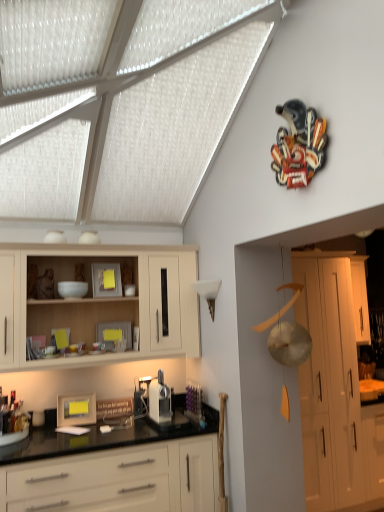
Question: From a real-world perspective, is light wood cabinet at upper left, acting as the 4th cabinetry starting from the right, over white glossy cabinet at right, which is the 1th cabinetry in right-to-left order?

Choices:
 (A) yes
 (B) no

Answer: (A)

Question: From a real-world perspective, does light wood cabinet at upper left, acting as the 4th cabinetry starting from the right, sit lower than white glossy cabinet at right, positioned as the 4th cabinetry in left-to-right order?

Choices:
 (A) yes
 (B) no

Answer: (B)

Question: Is white glossy cabinet at right, positioned as the 4th cabinetry in left-to-right order, at the back of light wood cabinet at upper left, which appears as the 1th cabinetry when viewed from the left?

Choices:
 (A) no
 (B) yes

Answer: (A)

Question: Considering the relative positions of light wood cabinet at upper left, acting as the 4th cabinetry starting from the right, and white glossy cabinet at right, positioned as the 4th cabinetry in left-to-right order, in the image provided, is light wood cabinet at upper left, acting as the 4th cabinetry starting from the right, to the right of white glossy cabinet at right, positioned as the 4th cabinetry in left-to-right order, from the viewer's perspective?

Choices:
 (A) yes
 (B) no

Answer: (B)

Question: Does light wood cabinet at upper left, which appears as the 1th cabinetry when viewed from the left, have a greater width compared to white glossy cabinet at right, which is the 1th cabinetry in right-to-left order?

Choices:
 (A) no
 (B) yes

Answer: (B)

Question: Is the position of light wood cabinet at upper left, acting as the 4th cabinetry starting from the right, less distant than that of white glossy cabinet at right, which is the 1th cabinetry in right-to-left order?

Choices:
 (A) yes
 (B) no

Answer: (A)

Question: Can you confirm if white glossy cabinets at lower center, the second cabinetry from the left, is thinner than white glossy cabinet at right, positioned as the 4th cabinetry in left-to-right order?

Choices:
 (A) no
 (B) yes

Answer: (A)

Question: Is white glossy cabinets at lower center, marked as the third cabinetry in a right-to-left arrangement, at the right side of white glossy cabinet at right, which is the 1th cabinetry in right-to-left order?

Choices:
 (A) yes
 (B) no

Answer: (B)

Question: Does white glossy cabinets at lower center, marked as the third cabinetry in a right-to-left arrangement, turn towards white glossy cabinet at right, positioned as the 4th cabinetry in left-to-right order?

Choices:
 (A) no
 (B) yes

Answer: (A)

Question: Does white glossy cabinets at lower center, marked as the third cabinetry in a right-to-left arrangement, have a greater width compared to white glossy cabinet at right, positioned as the 4th cabinetry in left-to-right order?

Choices:
 (A) no
 (B) yes

Answer: (B)

Question: Considering the relative positions of white glossy cabinets at lower center, marked as the third cabinetry in a right-to-left arrangement, and white glossy cabinet at right, positioned as the 4th cabinetry in left-to-right order, in the image provided, is white glossy cabinets at lower center, marked as the third cabinetry in a right-to-left arrangement, to the left of white glossy cabinet at right, positioned as the 4th cabinetry in left-to-right order, from the viewer's perspective?

Choices:
 (A) yes
 (B) no

Answer: (A)

Question: From a real-world perspective, is white glossy cabinets at lower center, the second cabinetry from the left, under white glossy cabinet at right, positioned as the 4th cabinetry in left-to-right order?

Choices:
 (A) no
 (B) yes

Answer: (B)

Question: Would you consider light wood cabinet at upper left, which appears as the 1th cabinetry when viewed from the left, to be distant from white matte cabinet at right, which is the second cabinetry from right to left?

Choices:
 (A) no
 (B) yes

Answer: (B)